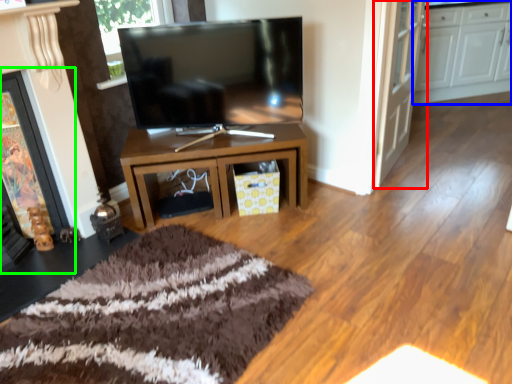
Question: Based on their relative distances, which object is farther from door (highlighted by a red box)? Choose from cabinetry (highlighted by a blue box) and fireplace (highlighted by a green box).

Choices:
 (A) cabinetry
 (B) fireplace

Answer: (B)